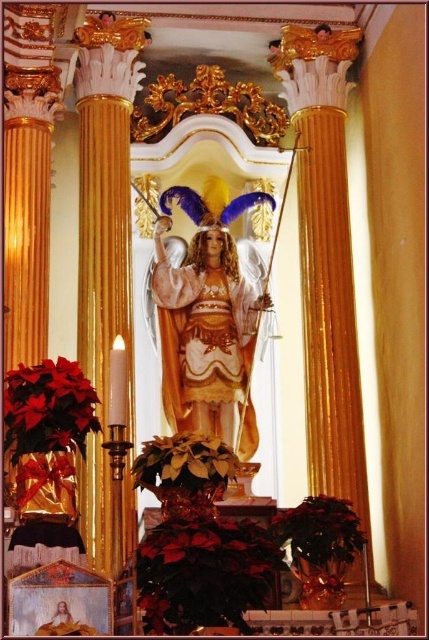
You are a visitor standing in front of the altar and want to take a photo of both the shiny red poinsettia at lower left and the green matte poinsettia at lower right. However, you notice that one is blocking the other. Which poinsettia is blocking the other one?

The shiny red poinsettia at lower left is in front of the green matte poinsettia at lower right, so it is blocking the view of the green matte poinsettia at lower right.

You are a visitor standing in front of the altar and want to place a small offering between the green leafy plant at center and the green matte poinsettia at lower right. Which object should you move closer to you to make space?

The green leafy plant at center is closer to the viewer than the green matte poinsettia at lower right. To make space, you should move the green leafy plant at center backward since it is closer and allows more room between them.

You are a visitor standing in front of the altar and want to place a small gift on the nearest object. Which object between the shiny red poinsettia at lower left and the green leafy plant at center should you choose?

The shiny red poinsettia at lower left is much taller than the green leafy plant at center, so the green leafy plant at center is shorter and likely closer to you. Place the gift on the green leafy plant at center.